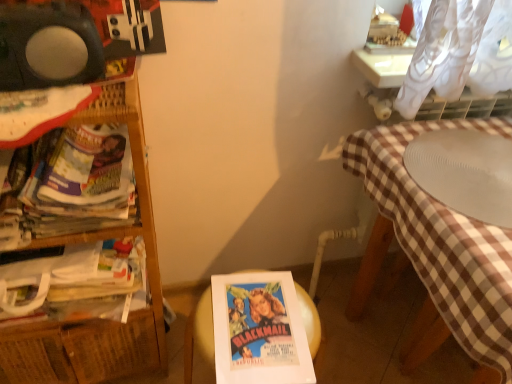
Question: Is woven wood shelf at left wider than white paper at center?

Choices:
 (A) yes
 (B) no

Answer: (A)

Question: Can you confirm if woven wood shelf at left is shorter than white paper at center?

Choices:
 (A) yes
 (B) no

Answer: (B)

Question: Is woven wood shelf at left taller than white paper at center?

Choices:
 (A) yes
 (B) no

Answer: (A)

Question: From the image's perspective, is woven wood shelf at left on white paper at center?

Choices:
 (A) no
 (B) yes

Answer: (B)

Question: Is white paper at center at the back of woven wood shelf at left?

Choices:
 (A) yes
 (B) no

Answer: (B)

Question: From a real-world perspective, is white paper book at left, positioned as the second book in bottom-to-top order, above or below white paper at center?

Choices:
 (A) below
 (B) above

Answer: (B)

Question: Looking at the image, does white paper book at left, the 1th book viewed from the top, seem bigger or smaller compared to white paper at center?

Choices:
 (A) big
 (B) small

Answer: (A)

Question: Considering the relative positions of white paper book at left, positioned as the second book in bottom-to-top order, and white paper at center in the image provided, is white paper book at left, positioned as the second book in bottom-to-top order, to the left or to the right of white paper at center?

Choices:
 (A) right
 (B) left

Answer: (B)

Question: Considering the positions of white paper book at left, positioned as the second book in bottom-to-top order, and white paper at center in the image, is white paper book at left, positioned as the second book in bottom-to-top order, wider or thinner than white paper at center?

Choices:
 (A) wide
 (B) thin

Answer: (A)

Question: From a real-world perspective, is white ribbed plate at right positioned above or below white paper at center?

Choices:
 (A) above
 (B) below

Answer: (A)

Question: Is white ribbed plate at right situated inside white paper at center or outside?

Choices:
 (A) outside
 (B) inside

Answer: (A)

Question: In terms of height, does white ribbed plate at right look taller or shorter compared to white paper at center?

Choices:
 (A) tall
 (B) short

Answer: (B)

Question: Considering the relative positions of white ribbed plate at right and white paper at center in the image provided, is white ribbed plate at right to the left or to the right of white paper at center?

Choices:
 (A) left
 (B) right

Answer: (B)

Question: In terms of size, does white paper at center appear bigger or smaller than white ribbed plate at right?

Choices:
 (A) big
 (B) small

Answer: (B)

Question: Is white paper at center wider or thinner than white ribbed plate at right?

Choices:
 (A) wide
 (B) thin

Answer: (B)